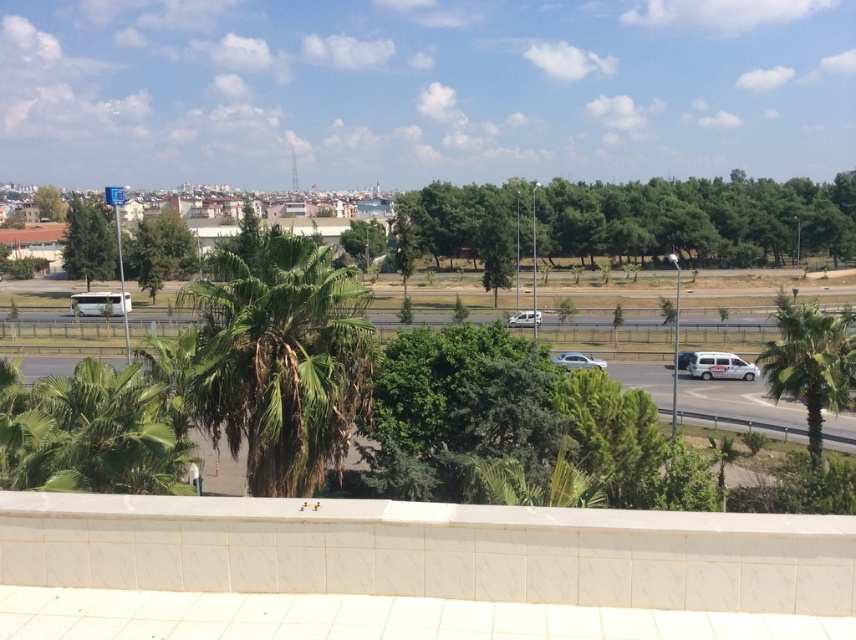
Is green leafy trees at center bigger than white metallic van at center?

Yes, green leafy trees at center is bigger than white metallic van at center.

Between point (473, 212) and point (538, 316), which one is positioned in front?

Point (538, 316)

Where is `green leafy trees at center`? green leafy trees at center is located at coordinates (699, 220).

Is white marble balcony at lower center to the left of green leafy tree at upper left from the viewer's perspective?

No, white marble balcony at lower center is not to the left of green leafy tree at upper left.

Does white marble balcony at lower center appear under green leafy tree at upper left?

Yes.

What do you see at coordinates (434, 564) in the screenshot? The image size is (856, 640). I see `white marble balcony at lower center` at bounding box center [434, 564].

The height and width of the screenshot is (640, 856). What are the coordinates of `white marble balcony at lower center` in the screenshot? It's located at (434, 564).

Looking at this image, can you confirm if green leafy trees at center is taller than green leafy tree at upper left?

Yes, green leafy trees at center is taller than green leafy tree at upper left.

Does green leafy trees at center appear over green leafy tree at upper left?

Incorrect, green leafy trees at center is not positioned above green leafy tree at upper left.

I want to click on green leafy trees at center, so click(x=699, y=220).